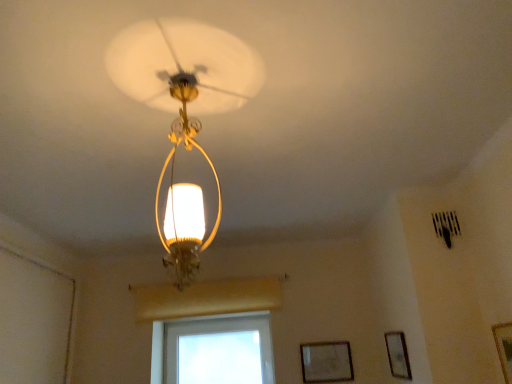
Question: From the image's perspective, is transparent glass window at center positioned above or below wooden framed picture at lower right, positioned as the 1th picture frame in back-to-front order?

Choices:
 (A) below
 (B) above

Answer: (A)

Question: Is point (267, 359) closer or farther from the camera than point (337, 352)?

Choices:
 (A) closer
 (B) farther

Answer: (B)

Question: Estimate the real-world distances between objects in this image. Which object is farther from the wooden framed picture at lower right, the 3th picture frame in the front-to-back sequence?

Choices:
 (A) wooden picture frame at lower right, positioned as the second picture frame in left-to-right order
 (B) wooden picture frame at lower right, marked as the 1th picture frame in a right-to-left arrangement
 (C) transparent glass window at center
 (D) matte gold chandelier at center

Answer: (D)

Question: Which of these objects is positioned farthest from the wooden picture frame at lower right, marked as the 1th picture frame in a right-to-left arrangement?

Choices:
 (A) transparent glass window at center
 (B) matte gold chandelier at center
 (C) wooden picture frame at lower right, the second picture frame in the right-to-left sequence
 (D) wooden framed picture at lower right, the 3th picture frame in the front-to-back sequence

Answer: (A)